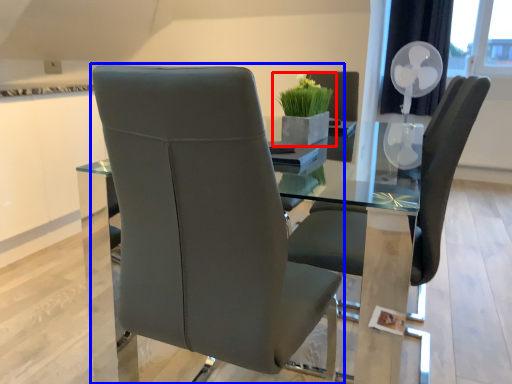
Question: Which object is closer to the camera taking this photo, houseplant (highlighted by a red box) or chair (highlighted by a blue box)?

Choices:
 (A) houseplant
 (B) chair

Answer: (B)